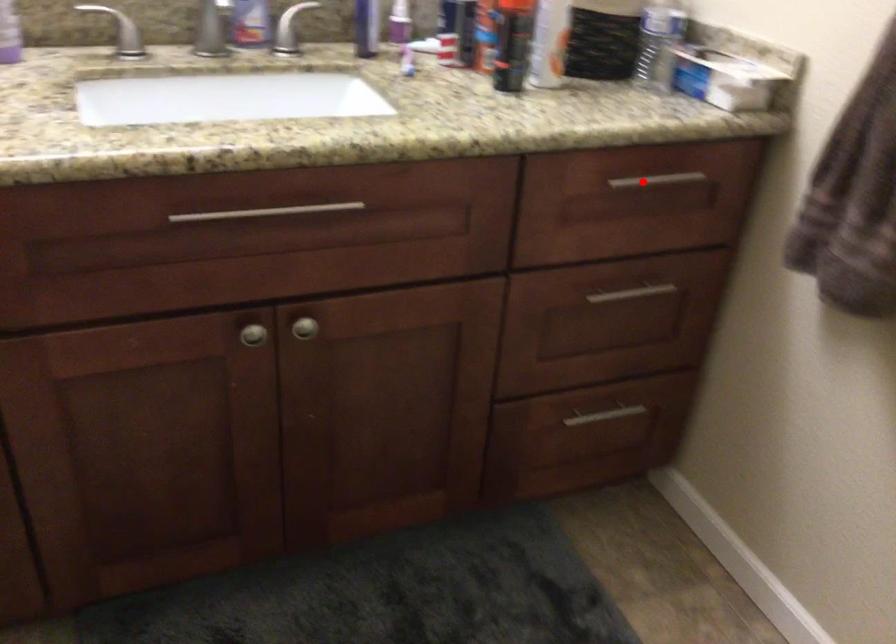
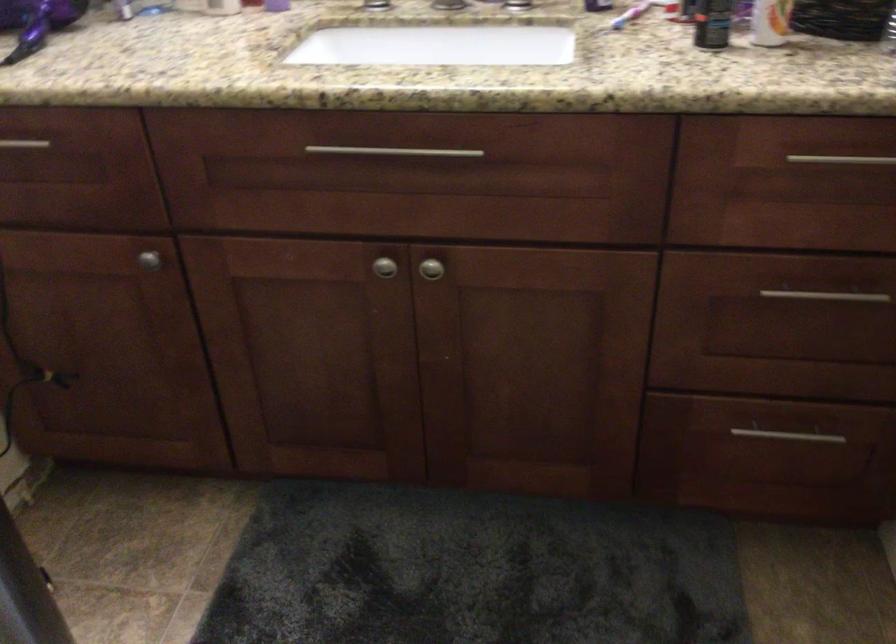
Find the pixel in the second image that matches the highlighted location in the first image.

(841, 158)